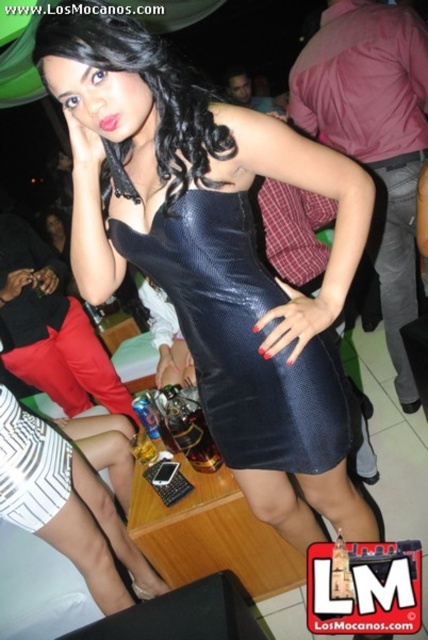
Is black leather dress at center below black leather pants at right?

Correct, black leather dress at center is located below black leather pants at right.

Between point (228, 356) and point (398, 289), which one is positioned in front?

Point (228, 356) is more forward.

Who is more forward, (x=228, y=253) or (x=398, y=244)?

Positioned in front is point (x=228, y=253).

Identify the location of black leather dress at center. The height and width of the screenshot is (640, 428). (241, 337).